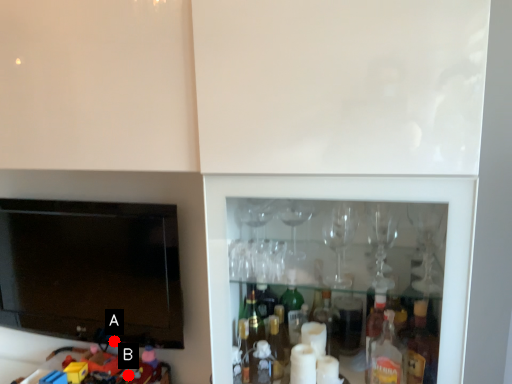
Question: Two points are circled on the image, labeled by A and B beside each circle. Among these points, which one is farthest from the camera?

Choices:
 (A) A is further
 (B) B is further

Answer: (A)